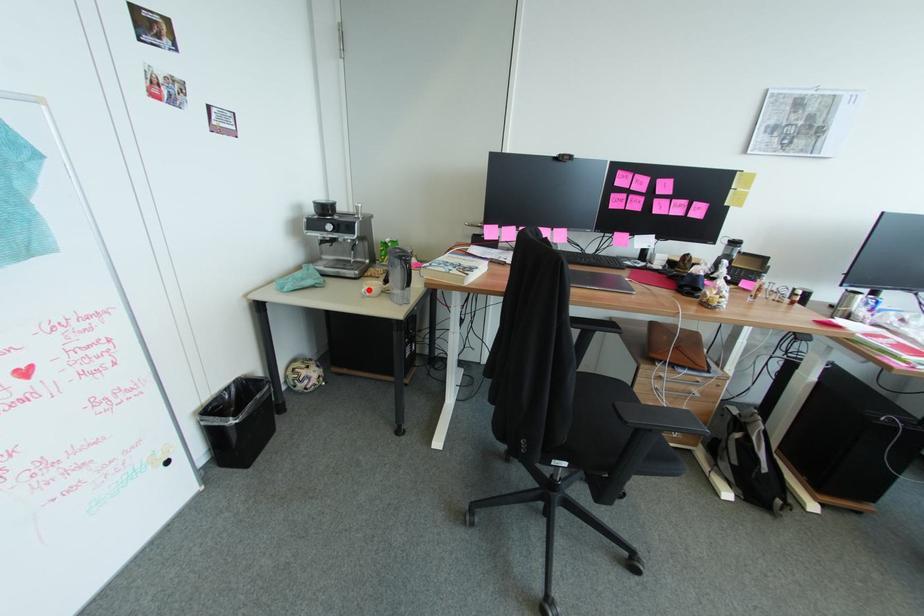
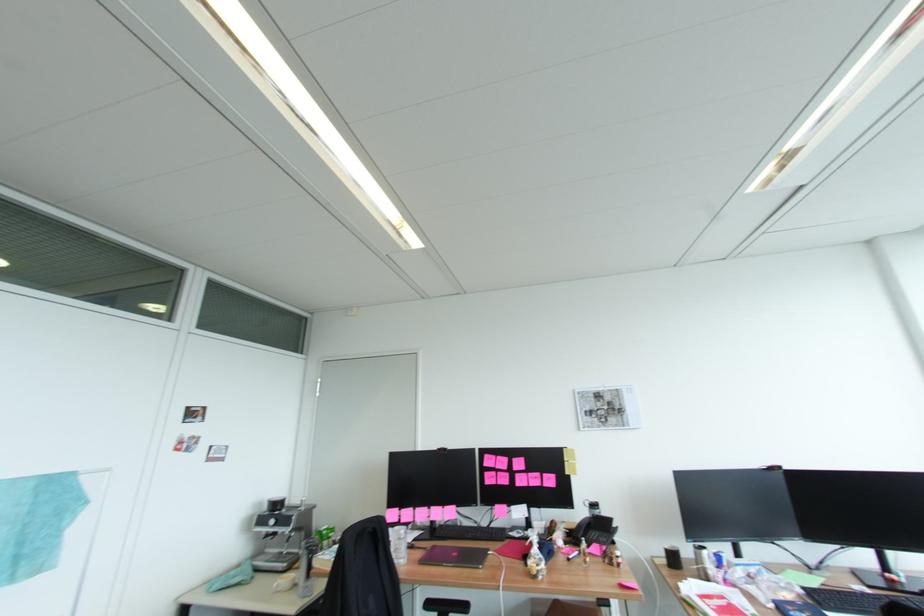
The point at the highlighted location is marked in the first image. Where is the corresponding point in the second image?

(282, 583)